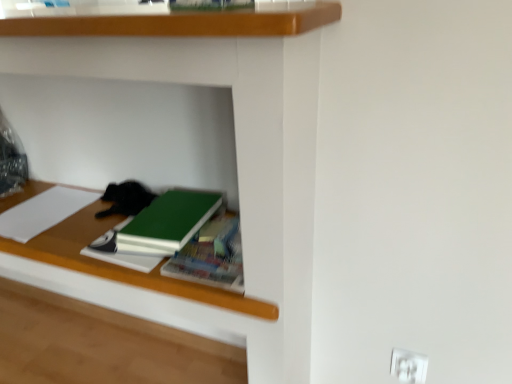
Question: Based on their positions, is black fur cat at center located to the left or right of white paper at left, the third book positioned from the right?

Choices:
 (A) left
 (B) right

Answer: (B)

Question: In terms of height, does black fur cat at center look taller or shorter compared to white paper at left, the third book positioned from the right?

Choices:
 (A) tall
 (B) short

Answer: (A)

Question: Which of these objects is positioned closest to the wooden shelf at center?

Choices:
 (A) green matte notebook at center
 (B) white plastic electric outlet at lower right
 (C) white paper at left, the first book viewed from the left
 (D) green matte book at center, which is the first book from right to left
 (E) black fur cat at center

Answer: (D)

Question: Which object is positioned closest to the wooden shelf at center?

Choices:
 (A) green matte notebook at center
 (B) white paper at left, the third book positioned from the right
 (C) white plastic electric outlet at lower right
 (D) black fur cat at center
 (E) green matte book at center, placed as the third book when sorted from left to right

Answer: (E)